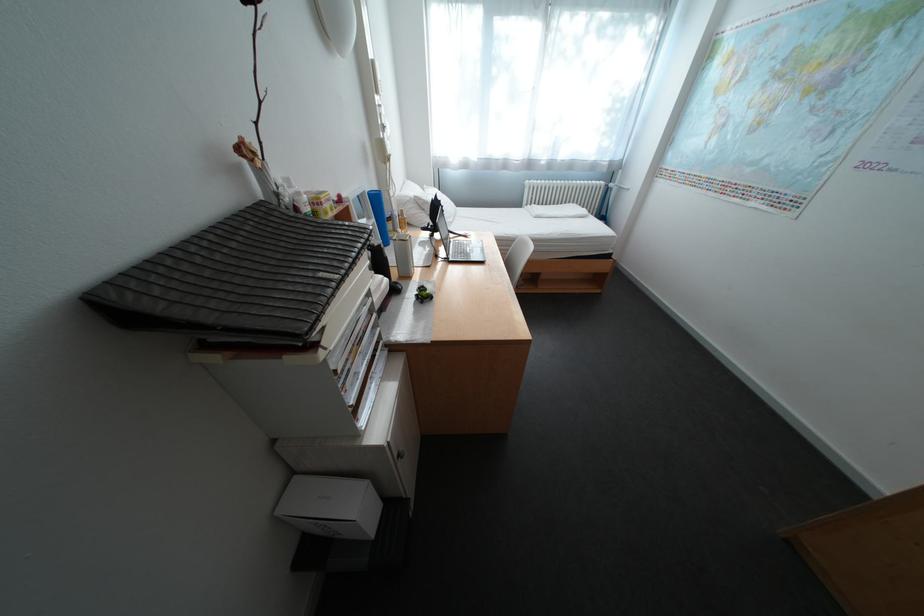
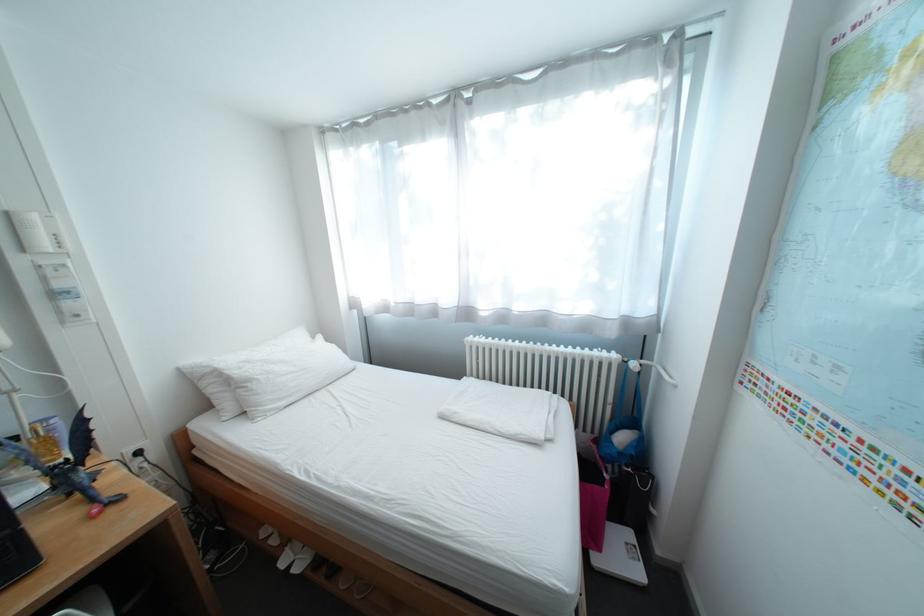
Find the pixel in the second image that matches (x=618, y=185) in the first image.

(637, 362)